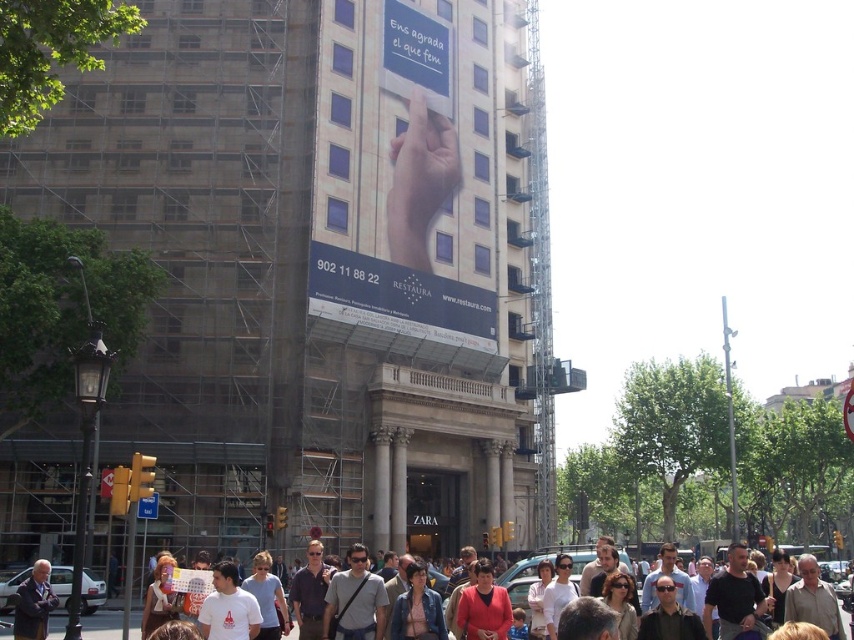
You are a tourist in the city and see the point marked at coordinates (399,300). What object is located at this point?

The point at coordinates (399,300) marks the location of the blue plastic signboard at center.

You are a tourist in this European city and want to read both the blue plastic signboard at center and the white paper sign at upper center. Which one is shorter?

The blue plastic signboard at center has a lesser height compared to the white paper sign at upper center, so the blue plastic signboard at center is shorter.